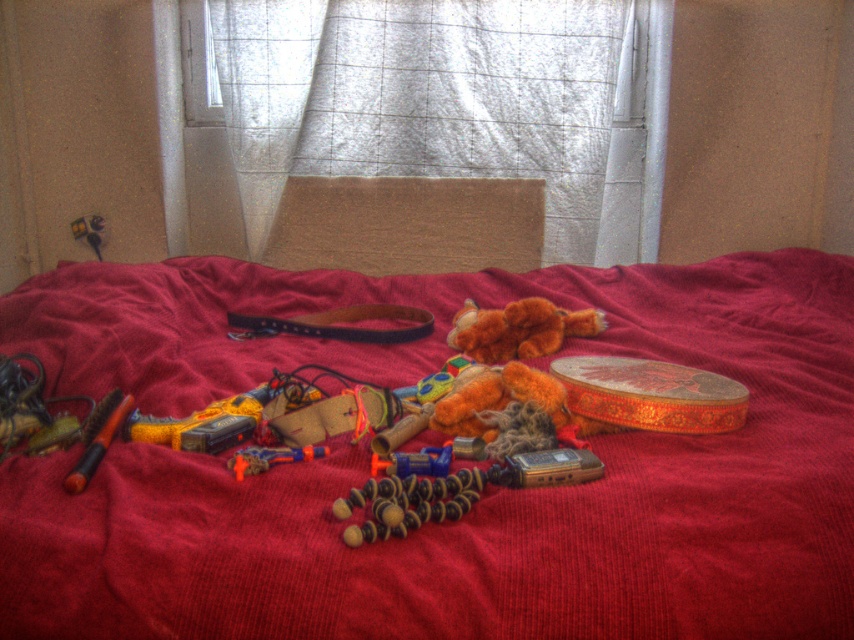
Image resolution: width=854 pixels, height=640 pixels. Identify the location of metallic gold phone at center. (547, 468).

Is the position of metallic gold phone at center more distant than that of orange plastic toy gun at center?

No, it is in front of orange plastic toy gun at center.

Which is in front, point (557, 452) or point (237, 458)?

Positioned in front is point (237, 458).

Identify the location of metallic gold phone at center. (547, 468).

Which of these two, velvet red bedspread at center or orange matte pen at lower left, stands shorter?

Standing shorter between the two is orange matte pen at lower left.

Is velvet red bedspread at center to the left of orange matte pen at lower left from the viewer's perspective?

Incorrect, velvet red bedspread at center is not on the left side of orange matte pen at lower left.

Does point (211, 346) come closer to viewer compared to point (80, 458)?

No, (211, 346) is further to viewer.

Identify the location of velvet red bedspread at center. (474, 504).

Is velvet red bedspread at center taller than metallic gold phone at center?

Yes, velvet red bedspread at center is taller than metallic gold phone at center.

Between velvet red bedspread at center and metallic gold phone at center, which one appears on the left side from the viewer's perspective?

metallic gold phone at center

Which is behind, point (174, 378) or point (591, 474)?

Point (174, 378)

The image size is (854, 640). Identify the location of velvet red bedspread at center. (474, 504).